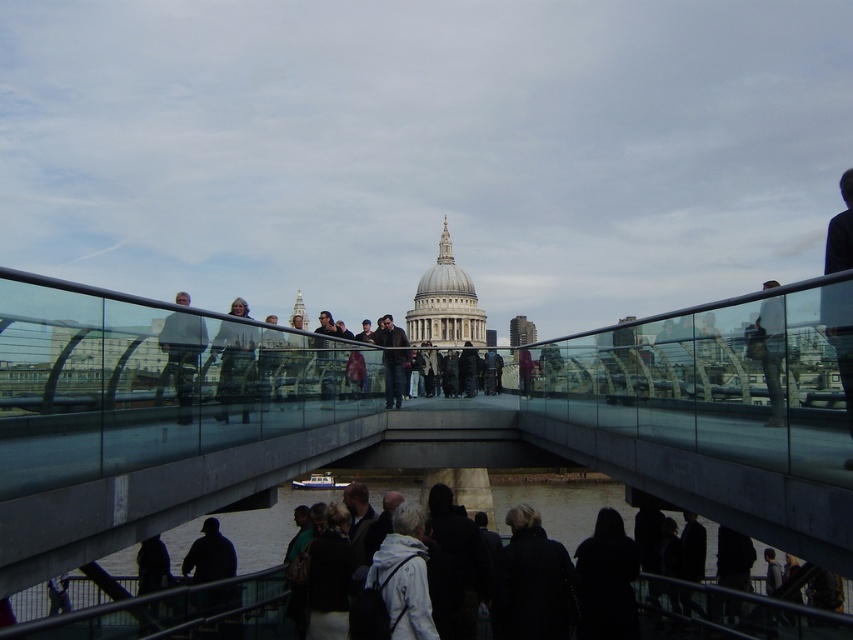
Question: Estimate the real-world distances between objects in this image. Which object is closer to the black matte coat at lower right?

Choices:
 (A) white matte jacket at center
 (B) dark wool coat at center
 (C) dark gray sweater at lower center

Answer: (B)

Question: Is dark wool coat at center below black matte coat at lower right?

Choices:
 (A) yes
 (B) no

Answer: (A)

Question: Can you confirm if glass pedestrian bridge at center is positioned to the left of black matte coat at lower right?

Choices:
 (A) yes
 (B) no

Answer: (A)

Question: Estimate the real-world distances between objects in this image. Which object is closer to the dark gray sweater at lower center?

Choices:
 (A) white matte jacket at center
 (B) glass pedestrian bridge at center
 (C) black matte coat at lower right
 (D) dark wool coat at center

Answer: (A)

Question: Can you confirm if white matte jacket at center is wider than dark gray sweater at lower center?

Choices:
 (A) no
 (B) yes

Answer: (B)

Question: Which point is closer to the camera?

Choices:
 (A) (404, 536)
 (B) (589, 582)

Answer: (A)